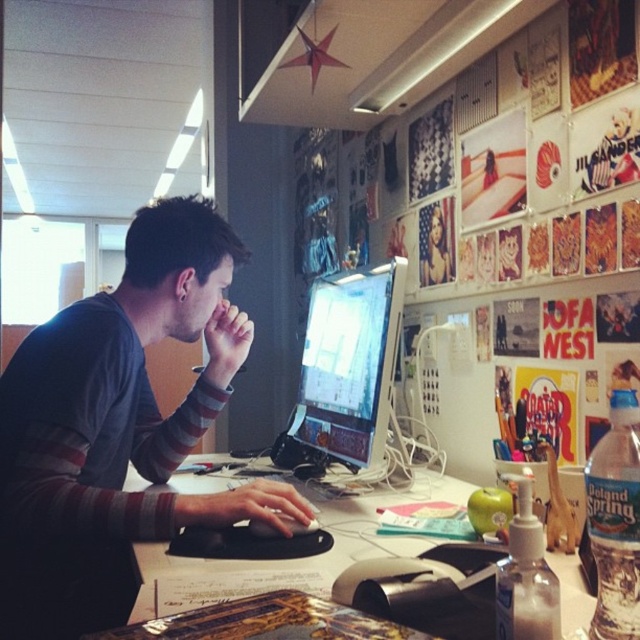
Is gray striped shirt at center positioned at the back of satin black monitor at center?

That is False.

Which is more to the left, gray striped shirt at center or satin black monitor at center?

Positioned to the left is gray striped shirt at center.

Between point (225, 522) and point (301, 412), which one is positioned behind?

Positioned behind is point (301, 412).

Find the location of `gray striped shirt at center`. gray striped shirt at center is located at coordinates (116, 428).

Between white plastic computer desk at center and satin black monitor at center, which one has less height?

white plastic computer desk at center

Is white plastic computer desk at center to the right of satin black monitor at center from the viewer's perspective?

Incorrect, white plastic computer desk at center is not on the right side of satin black monitor at center.

Locate an element on the screen. Image resolution: width=640 pixels, height=640 pixels. white plastic computer desk at center is located at coordinates (289, 560).

Can you confirm if gray striped shirt at center is positioned below white plastic computer desk at center?

Actually, gray striped shirt at center is above white plastic computer desk at center.

At what (x,y) coordinates should I click in order to perform the action: click on gray striped shirt at center. Please return your answer as a coordinate pair (x, y). Looking at the image, I should click on (116, 428).